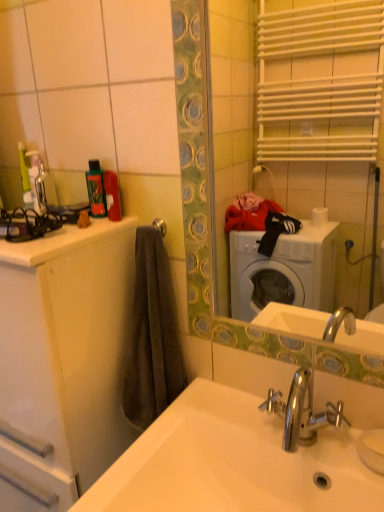
What do you see at coordinates (232, 116) in the screenshot?
I see `white glossy mirror at upper center` at bounding box center [232, 116].

The width and height of the screenshot is (384, 512). Describe the element at coordinates (233, 463) in the screenshot. I see `white glossy sink at lower center` at that location.

The width and height of the screenshot is (384, 512). What are the coordinates of `green plastic bottle at upper left` in the screenshot? It's located at (96, 189).

Is white glossy sink at lower center thinner than green plastic bottle at upper left?

Incorrect, the width of white glossy sink at lower center is not less than that of green plastic bottle at upper left.

From a real-world perspective, who is located lower, white glossy sink at lower center or green plastic bottle at upper left?

From a 3D spatial view, white glossy sink at lower center is below.

Locate an element on the screen. toiletry on the left of white glossy sink at lower center is located at coordinates (96, 189).

Which is behind, white glossy sink at lower center or green plastic bottle at upper left?

green plastic bottle at upper left is behind.

From a real-world perspective, is green plastic bottle at upper left beneath white glossy sink at lower center?

No.

Which is more to the right, green plastic bottle at upper left or white glossy sink at lower center?

white glossy sink at lower center is more to the right.

Could you tell me if green plastic bottle at upper left is turned towards white glossy sink at lower center?

No, green plastic bottle at upper left is not turned towards white glossy sink at lower center.

Which is in front, point (99, 206) or point (112, 482)?

The point (112, 482) is in front.

What's the angular difference between white glossy mirror at upper center and green plastic bottle at upper left's facing directions?

The angular difference between white glossy mirror at upper center and green plastic bottle at upper left is 0.496 degrees.

Is white glossy mirror at upper center looking in the opposite direction of green plastic bottle at upper left?

No, white glossy mirror at upper center is not facing away from green plastic bottle at upper left.

Considering the sizes of objects white glossy mirror at upper center and green plastic bottle at upper left in the image provided, who is thinner, white glossy mirror at upper center or green plastic bottle at upper left?

Thinner between the two is white glossy mirror at upper center.

From the picture: Are white glossy mirror at upper center and green plastic bottle at upper left beside each other?

There is a gap between white glossy mirror at upper center and green plastic bottle at upper left.

From a real-world perspective, who is located higher, green plastic bottle at upper left or white glossy cabinet at left?

From a 3D spatial view, green plastic bottle at upper left is above.

From the picture: Can you tell me how much green plastic bottle at upper left and white glossy cabinet at left differ in facing direction?

The angular difference between green plastic bottle at upper left and white glossy cabinet at left is 5.96e-05 degrees.

Considering the relative sizes of green plastic bottle at upper left and white glossy cabinet at left in the image provided, is green plastic bottle at upper left shorter than white glossy cabinet at left?

Yes.

Does point (99, 188) lie in front of point (2, 492)?

Yes, it is.

Does white glossy sink at lower center have a lesser width compared to white glossy mirror at upper center?

No, white glossy sink at lower center is not thinner than white glossy mirror at upper center.

Who is taller, white glossy sink at lower center or white glossy mirror at upper center?

With more height is white glossy mirror at upper center.

Is point (306, 502) closer or farther from the camera than point (230, 131)?

Point (306, 502).

From a real-world perspective, does white glossy cabinet at left stand above white glossy sink at lower center?

Indeed, from a real-world perspective, white glossy cabinet at left stands above white glossy sink at lower center.

Can you confirm if white glossy cabinet at left is wider than white glossy sink at lower center?

Incorrect, the width of white glossy cabinet at left does not surpass that of white glossy sink at lower center.

The height and width of the screenshot is (512, 384). Identify the location of sink on the right of white glossy cabinet at left. (233, 463).

Consider the image. Are white glossy cabinet at left and white glossy sink at lower center making contact?

white glossy cabinet at left and white glossy sink at lower center are not in contact.

Is white glossy cabinet at left inside or outside of white glossy mirror at upper center?

white glossy cabinet at left is located beyond the bounds of white glossy mirror at upper center.

You are a GUI agent. You are given a task and a screenshot of the screen. Output one action in this format:
    pyautogui.click(x=<x>, y=<y>)
    Task: Click on the mirror that is above the white glossy cabinet at left (from a real-world perspective)
    This screenshot has height=512, width=384.
    Given the screenshot: What is the action you would take?
    pyautogui.click(x=232, y=116)

Which object is closer to the camera, white glossy cabinet at left or white glossy mirror at upper center?

Positioned in front is white glossy mirror at upper center.

Would you consider white glossy cabinet at left to be distant from white glossy mirror at upper center?

That's right, there is a large distance between white glossy cabinet at left and white glossy mirror at upper center.

You are a GUI agent. You are given a task and a screenshot of the screen. Output one action in this format:
    pyautogui.click(x=<x>, y=<y>)
    Task: Click on the toiletry behind the white glossy sink at lower center
    This screenshot has width=384, height=512.
    Given the screenshot: What is the action you would take?
    pyautogui.click(x=96, y=189)

This screenshot has width=384, height=512. In order to click on toiletry located above the white glossy sink at lower center (from the image's perspective) in this screenshot , I will do `click(96, 189)`.

Considering their positions, is white glossy mirror at upper center positioned closer to white glossy sink at lower center than green plastic bottle at upper left?

Among the two, green plastic bottle at upper left is located nearer to white glossy sink at lower center.

From the image, which object appears to be nearer to white glossy sink at lower center, green plastic bottle at upper left or white glossy mirror at upper center?

green plastic bottle at upper left.

Based on their spatial positions, is white glossy sink at lower center or white glossy mirror at upper center further from white glossy cabinet at left?

white glossy mirror at upper center.

From the image, which object appears to be farther from white glossy cabinet at left, green plastic bottle at upper left or white glossy mirror at upper center?

white glossy mirror at upper center.

Considering their positions, is white glossy cabinet at left positioned further to green plastic bottle at upper left than white glossy sink at lower center?

white glossy sink at lower center is further to green plastic bottle at upper left.

Based on their spatial positions, is green plastic bottle at upper left or white glossy cabinet at left closer to white glossy sink at lower center?

The object closer to white glossy sink at lower center is white glossy cabinet at left.

Looking at the image, which one is located further to white glossy sink at lower center, white glossy cabinet at left or white glossy mirror at upper center?

white glossy mirror at upper center.

Considering their positions, is green plastic bottle at upper left positioned further to white glossy mirror at upper center than white glossy cabinet at left?

Among the two, green plastic bottle at upper left is located further to white glossy mirror at upper center.

Where is `bathroom cabinet between white glossy mirror at upper center and white glossy sink at lower center in the vertical direction`? bathroom cabinet between white glossy mirror at upper center and white glossy sink at lower center in the vertical direction is located at coordinates (66, 351).

Locate an element on the screen. Image resolution: width=384 pixels, height=512 pixels. mirror between green plastic bottle at upper left and white glossy sink at lower center vertically is located at coordinates (232, 116).

You are a GUI agent. You are given a task and a screenshot of the screen. Output one action in this format:
    pyautogui.click(x=<x>, y=<y>)
    Task: Click on the bathroom cabinet between green plastic bottle at upper left and white glossy sink at lower center from top to bottom
    The width and height of the screenshot is (384, 512).
    Given the screenshot: What is the action you would take?
    pyautogui.click(x=66, y=351)

Image resolution: width=384 pixels, height=512 pixels. In order to click on mirror between green plastic bottle at upper left and white glossy cabinet at left from top to bottom in this screenshot , I will do `click(232, 116)`.